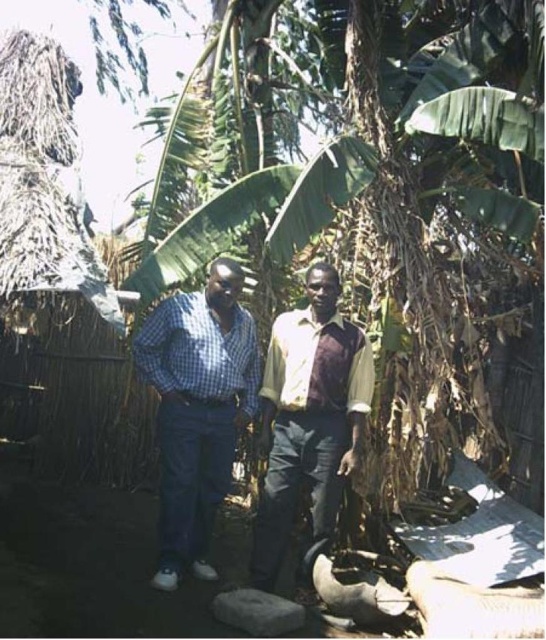
Measure the distance from checkered fabric shirt at center to light brown fabric shirt at center.

The distance of checkered fabric shirt at center from light brown fabric shirt at center is 20.16 inches.

Does checkered fabric shirt at center appear over light brown fabric shirt at center?

Indeed, checkered fabric shirt at center is positioned over light brown fabric shirt at center.

Who is more distant from viewer, (x=211, y=568) or (x=257, y=532)?

Point (x=211, y=568)

Locate an element on the screen. checkered fabric shirt at center is located at coordinates (198, 408).